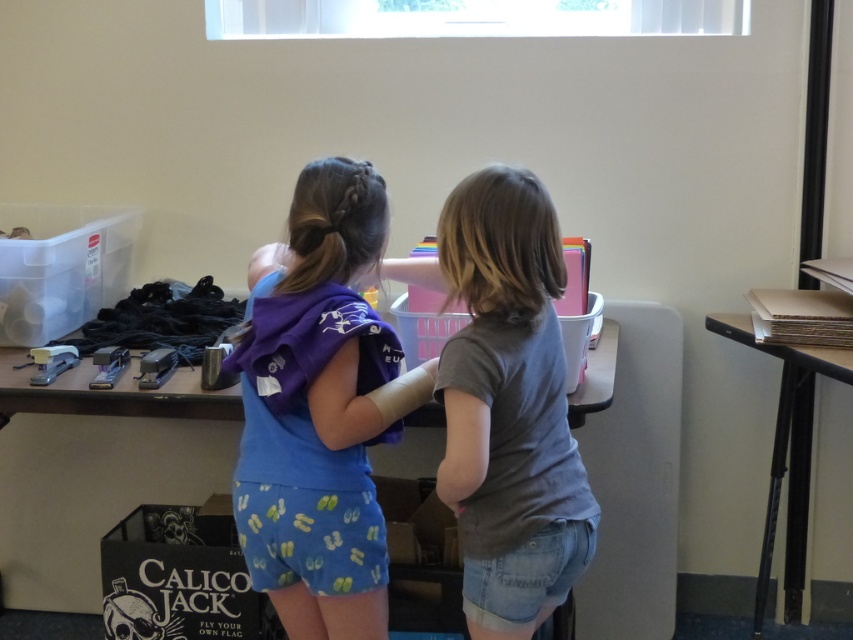
Who is higher up, blue cotton shirt at center or smooth cardboard stack at right?

blue cotton shirt at center is above.

Is blue cotton shirt at center bigger than smooth cardboard stack at right?

Actually, blue cotton shirt at center might be smaller than smooth cardboard stack at right.

Between point (346, 609) and point (788, 436), which one is positioned behind?

The point (788, 436) is behind.

This screenshot has width=853, height=640. I want to click on blue cotton shirt at center, so click(x=321, y=404).

Who is more distant from viewer, (144, 440) or (526, 179)?

The point (144, 440) is behind.

Is wooden table at center below gray matte shirt at center?

Correct, wooden table at center is located below gray matte shirt at center.

Which is in front, point (148, 493) or point (461, 516)?

Positioned in front is point (461, 516).

This screenshot has height=640, width=853. I want to click on wooden table at center, so click(x=91, y=493).

Consider the image. Does blue cotton shirt at center appear under wooden table at center?

No, blue cotton shirt at center is not below wooden table at center.

This screenshot has height=640, width=853. What are the coordinates of `blue cotton shirt at center` in the screenshot? It's located at (321, 404).